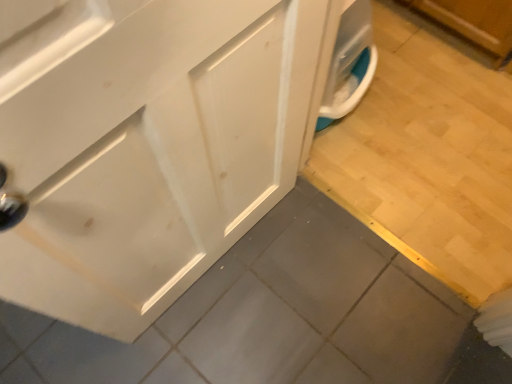
The height and width of the screenshot is (384, 512). I want to click on wooden tile at lower right, so click(x=428, y=159).

What do you see at coordinates (428, 159) in the screenshot? I see `wooden tile at lower right` at bounding box center [428, 159].

Measure the distance between wooden tile at lower right and camera.

They are 1.24 meters apart.

What is the approximate width of wooden tile at lower right?

It is 35.97 inches.

At what (x,y) coordinates should I click in order to perform the action: click on white glossy cabinet at center. Please return your answer as a coordinate pair (x, y). The height and width of the screenshot is (384, 512). Looking at the image, I should click on (147, 147).

Image resolution: width=512 pixels, height=384 pixels. What do you see at coordinates (147, 147) in the screenshot?
I see `white glossy cabinet at center` at bounding box center [147, 147].

In order to face white glossy cabinet at center, should I rotate leftwards or rightwards?

Turn left by 9.369 degrees to look at white glossy cabinet at center.

In order to click on wooden tile at lower right in this screenshot , I will do `click(428, 159)`.

Which is more to the left, wooden tile at lower right or white glossy cabinet at center?

white glossy cabinet at center is more to the left.

Is the depth of wooden tile at lower right greater than that of white glossy cabinet at center?

That is True.

Considering the points (378, 102) and (199, 186), which point is behind, point (378, 102) or point (199, 186)?

The point (378, 102) is more distant.

From the image's perspective, which is above, wooden tile at lower right or white glossy cabinet at center?

From the image's view, wooden tile at lower right is above.

From a real-world perspective, is wooden tile at lower right above or below white glossy cabinet at center?

In terms of real-world spatial position, wooden tile at lower right is below white glossy cabinet at center.

Which of these two, wooden tile at lower right or white glossy cabinet at center, is thinner?

white glossy cabinet at center is thinner.

Who is shorter, wooden tile at lower right or white glossy cabinet at center?

wooden tile at lower right is shorter.

Can you confirm if wooden tile at lower right is smaller than white glossy cabinet at center?

Yes, wooden tile at lower right is smaller than white glossy cabinet at center.

Choose the correct answer: Is wooden tile at lower right inside white glossy cabinet at center or outside it?

wooden tile at lower right is located beyond the bounds of white glossy cabinet at center.

Would you say wooden tile at lower right is a long distance from white glossy cabinet at center?

wooden tile at lower right is near white glossy cabinet at center, not far away.

Is wooden tile at lower right oriented away from white glossy cabinet at center?

No.

How many degrees apart are the facing directions of wooden tile at lower right and white glossy cabinet at center?

The angular difference between wooden tile at lower right and white glossy cabinet at center is 82.2 degrees.

Locate an element on the screen. tile below the white glossy cabinet at center (from a real-world perspective) is located at coordinates (428, 159).

Which object is positioned more to the right, white glossy cabinet at center or wooden tile at lower right?

Positioned to the right is wooden tile at lower right.

Considering the positions of objects white glossy cabinet at center and wooden tile at lower right in the image provided, who is behind, white glossy cabinet at center or wooden tile at lower right?

wooden tile at lower right is further away from the camera.

Which is nearer, (223, 49) or (494, 87)?

Point (223, 49) appears to be closer to the viewer than point (494, 87).

From the image's perspective, is white glossy cabinet at center on top of wooden tile at lower right?

No.

From a real-world perspective, is white glossy cabinet at center on wooden tile at lower right?

Yes, from a real-world perspective, white glossy cabinet at center is above wooden tile at lower right.

Is white glossy cabinet at center thinner than wooden tile at lower right?

Yes.

Considering the sizes of objects white glossy cabinet at center and wooden tile at lower right in the image provided, who is taller, white glossy cabinet at center or wooden tile at lower right?

white glossy cabinet at center.

Is white glossy cabinet at center bigger or smaller than wooden tile at lower right?

Clearly, white glossy cabinet at center is larger in size than wooden tile at lower right.

Would you say white glossy cabinet at center is inside or outside wooden tile at lower right?

white glossy cabinet at center is not inside wooden tile at lower right, it's outside.

Does white glossy cabinet at center touch wooden tile at lower right?

white glossy cabinet at center is not next to wooden tile at lower right, and they're not touching.

Is white glossy cabinet at center facing towards wooden tile at lower right?

No, white glossy cabinet at center is not turned towards wooden tile at lower right.

How much distance is there between white glossy cabinet at center and wooden tile at lower right?

white glossy cabinet at center is 26.35 inches from wooden tile at lower right.

You are a GUI agent. You are given a task and a screenshot of the screen. Output one action in this format:
    pyautogui.click(x=<x>, y=<y>)
    Task: Click on the cabinetry in front of the wooden tile at lower right
    
    Given the screenshot: What is the action you would take?
    pyautogui.click(x=147, y=147)

Where is `cabinetry on the left of wooden tile at lower right`? This screenshot has width=512, height=384. cabinetry on the left of wooden tile at lower right is located at coordinates (147, 147).

Where is `tile below the white glossy cabinet at center (from a real-world perspective)`? The height and width of the screenshot is (384, 512). tile below the white glossy cabinet at center (from a real-world perspective) is located at coordinates (428, 159).